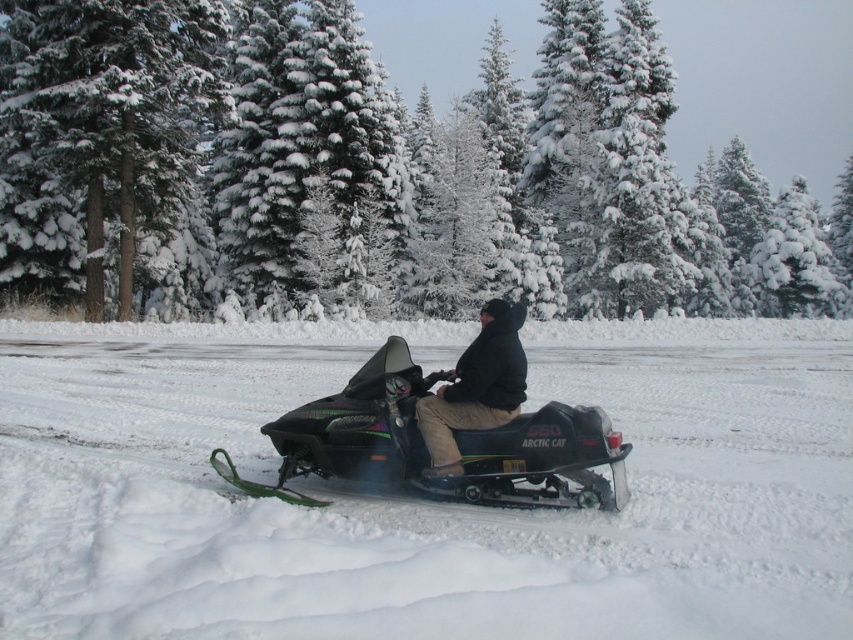
Question: Can you confirm if black matte snowmobile at center is positioned to the right of black matte jacket at center?

Choices:
 (A) no
 (B) yes

Answer: (A)

Question: Which point is closer to the camera taking this photo?

Choices:
 (A) (80, 582)
 (B) (558, 502)
 (C) (445, 416)
 (D) (805, 64)

Answer: (A)

Question: Among these objects, which one is nearest to the camera?

Choices:
 (A) black matte jacket at center
 (B) green textured pine tree at center

Answer: (A)

Question: Which object is farther from the camera taking this photo?

Choices:
 (A) green textured pine tree at center
 (B) black matte snowmobile at center
 (C) white fluffy snow at center

Answer: (A)

Question: Is white fluffy snow at center further to the viewer compared to green textured pine tree at center?

Choices:
 (A) yes
 (B) no

Answer: (B)

Question: Does green textured pine tree at center have a larger size compared to black matte jacket at center?

Choices:
 (A) no
 (B) yes

Answer: (B)